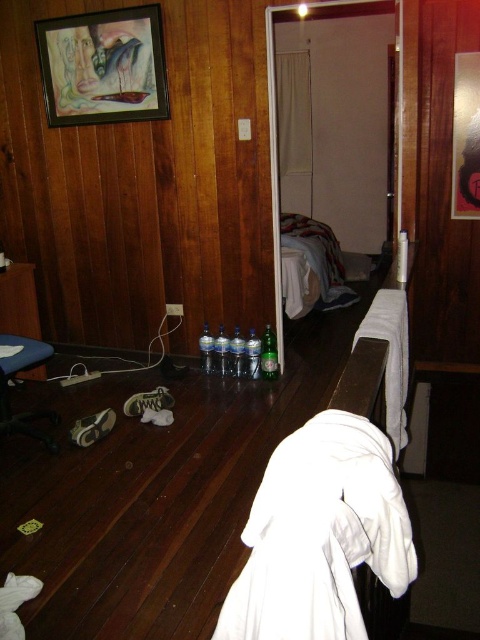
Question: Does matte black picture frame at upper left have a smaller size compared to white fabric bed at center?

Choices:
 (A) no
 (B) yes

Answer: (B)

Question: Which of the following is the farthest from the observer?

Choices:
 (A) white soft robe at center
 (B) matte black picture frame at upper left

Answer: (B)

Question: Is white soft robe at center to the right of matte black picture frame at upper left from the viewer's perspective?

Choices:
 (A) no
 (B) yes

Answer: (B)

Question: Which point is farther to the camera?

Choices:
 (A) white soft robe at center
 (B) white fabric bed at center
 (C) matte black picture frame at upper left

Answer: (B)

Question: Considering the real-world distances, which object is farthest from the matte black picture frame at upper left?

Choices:
 (A) white fabric bed at center
 (B) white soft robe at center

Answer: (B)

Question: Where is white soft robe at center located in relation to white fabric bed at center in the image?

Choices:
 (A) above
 (B) below

Answer: (B)